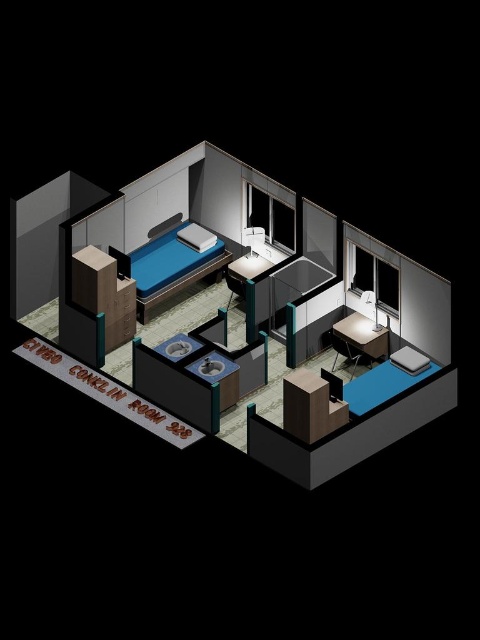
In the scene shown: You are navigating a video game character through the isometric room. The game requires you to place a small nightstand exactly 0.2 units to the right of the matte blue bed at center. What are the coordinates where you should place the nightstand?

Answer: The coordinates for the nightstand would be calculated by adding 0.2 to the x coordinate of the matte blue bed at center. The original coordinates are (168, 268). Adding 0.2 to the x gives 0.619. Therefore, the nightstand should be placed at coordinates (168, 396).

You are a delivery robot that is 0.5 meters wide. You need to move from the wooden cabinet at lower left to the wooden desk at center. Is there enough space for you to navigate the path between them?

The wooden cabinet at lower left is 4.91 meters away from the wooden desk at center. Since the robot is only 0.5 meters wide, the distance between them is sufficient for the robot to navigate the path between them.